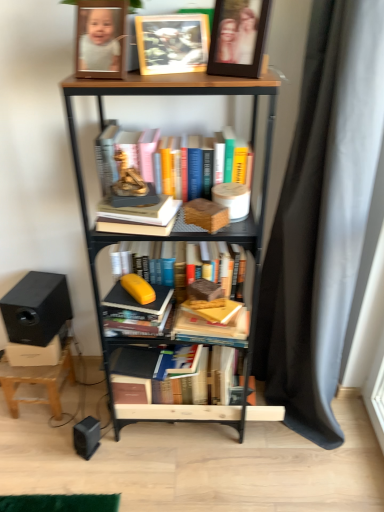
You are a GUI agent. You are given a task and a screenshot of the screen. Output one action in this format:
    pyautogui.click(x=<x>, y=<y>)
    Task: Click on the vacant space situated on the left part of black plastic speaker at lower left, the first speaker in the right-to-left sequence
    The width and height of the screenshot is (384, 512).
    Given the screenshot: What is the action you would take?
    pyautogui.click(x=50, y=451)